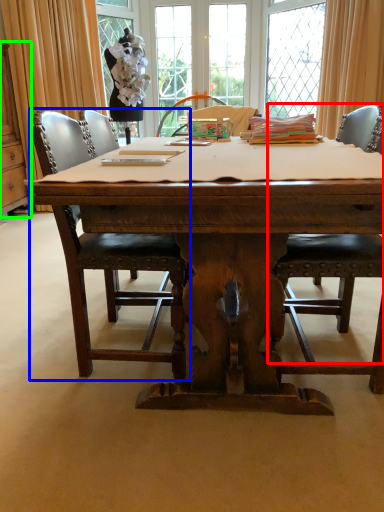
Question: Estimate the real-world distances between objects in this image. Which object is closer to chair (highlighted by a red box), chair (highlighted by a blue box) or cabinetry (highlighted by a green box)?

Choices:
 (A) chair
 (B) cabinetry

Answer: (A)